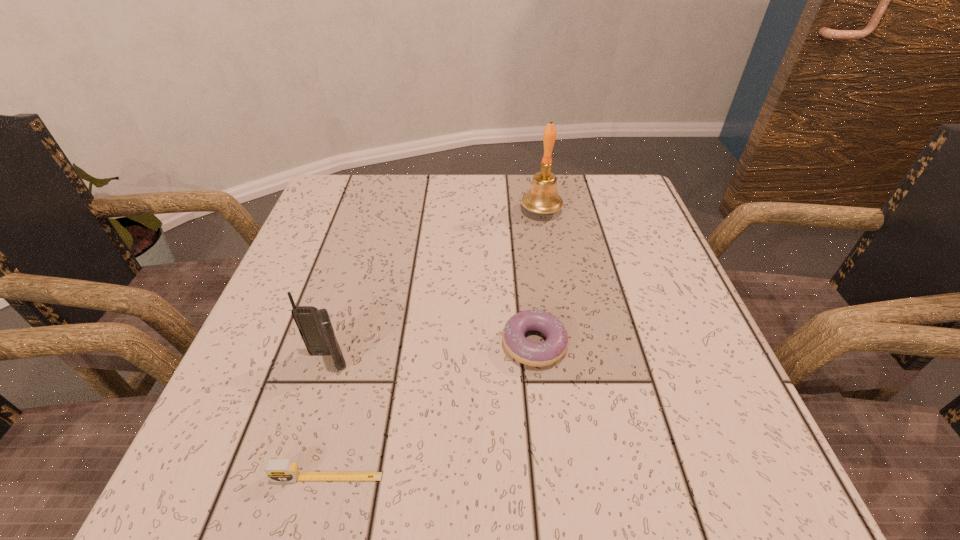
I want to click on object that is the second closest to the nearest object, so 550,351.